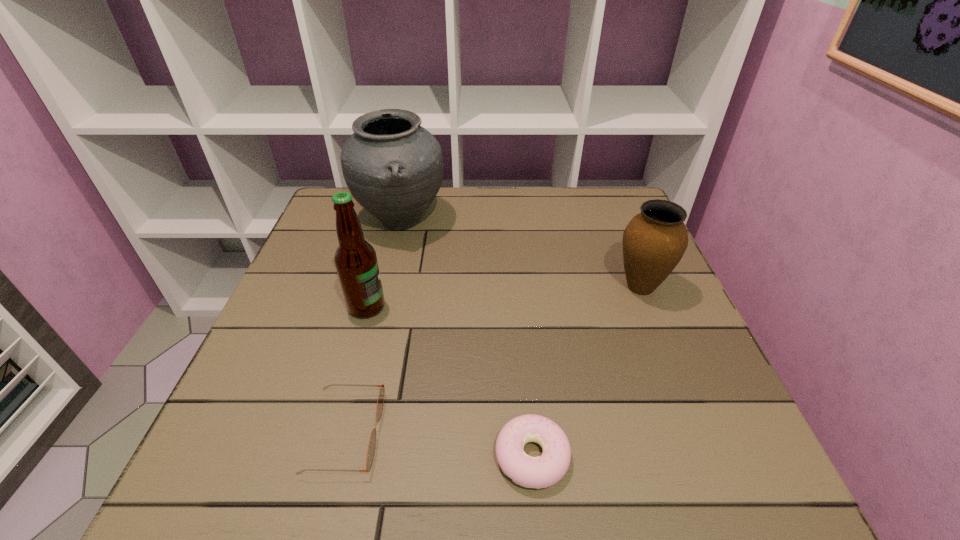
The width and height of the screenshot is (960, 540). In order to click on vacant area in the image that satisfies the following two spatial constraints: 1. on the back side of the second object from right to left; 2. on the label of the beer bottle in this screenshot , I will do `click(518, 307)`.

What are the coordinates of `blank space that satisfies the following two spatial constraints: 1. on the face of the sunglasses; 2. on the left side of the doughnut` in the screenshot? It's located at (340, 456).

At what (x,y) coordinates should I click in order to perform the action: click on vacant area that satisfies the following two spatial constraints: 1. on the back side of the doughnut; 2. on the face of the sunglasses. Please return your answer as a coordinate pair (x, y). The height and width of the screenshot is (540, 960). Looking at the image, I should click on (530, 433).

I want to click on free point that satisfies the following two spatial constraints: 1. on the front side of the farther urn; 2. on the label of the beer bottle, so click(380, 307).

Identify the location of free space that satisfies the following two spatial constraints: 1. on the label of the second object from right to left; 2. on the left side of the beer bottle. This screenshot has width=960, height=540. (326, 456).

Identify the location of vacant point that satisfies the following two spatial constraints: 1. on the label of the beer bottle; 2. on the left side of the doughnut. (326, 456).